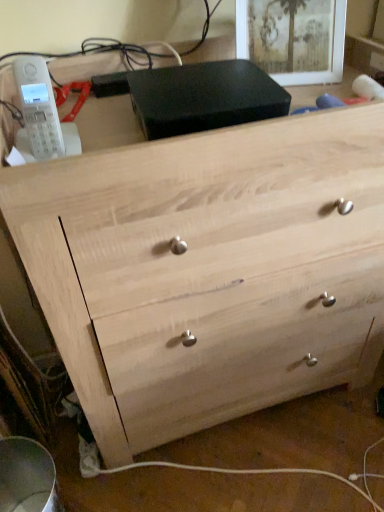
Question: Can you confirm if matte black picture frame at upper center is wider than natural wood chest of drawers at center?

Choices:
 (A) yes
 (B) no

Answer: (B)

Question: Does matte black picture frame at upper center appear on the left side of natural wood chest of drawers at center?

Choices:
 (A) yes
 (B) no

Answer: (B)

Question: From a real-world perspective, is matte black picture frame at upper center positioned over natural wood chest of drawers at center based on gravity?

Choices:
 (A) yes
 (B) no

Answer: (A)

Question: Can you see matte black picture frame at upper center touching natural wood chest of drawers at center?

Choices:
 (A) no
 (B) yes

Answer: (A)

Question: Can you confirm if matte black picture frame at upper center is positioned to the right of natural wood chest of drawers at center?

Choices:
 (A) no
 (B) yes

Answer: (B)

Question: Does matte black picture frame at upper center turn towards natural wood chest of drawers at center?

Choices:
 (A) no
 (B) yes

Answer: (B)

Question: Considering the relative positions of natural wood chest of drawers at center and matte black picture frame at upper center in the image provided, is natural wood chest of drawers at center behind matte black picture frame at upper center?

Choices:
 (A) no
 (B) yes

Answer: (A)

Question: Considering the relative sizes of natural wood chest of drawers at center and matte black picture frame at upper center in the image provided, is natural wood chest of drawers at center wider than matte black picture frame at upper center?

Choices:
 (A) no
 (B) yes

Answer: (B)

Question: From a real-world perspective, is natural wood chest of drawers at center physically below matte black picture frame at upper center?

Choices:
 (A) no
 (B) yes

Answer: (B)

Question: Can you confirm if natural wood chest of drawers at center is positioned to the right of matte black picture frame at upper center?

Choices:
 (A) no
 (B) yes

Answer: (A)

Question: From the image's perspective, is natural wood chest of drawers at center located beneath matte black picture frame at upper center?

Choices:
 (A) no
 (B) yes

Answer: (B)

Question: Is natural wood chest of drawers at center aimed at matte black picture frame at upper center?

Choices:
 (A) no
 (B) yes

Answer: (A)

Question: Does point (284, 77) appear closer or farther from the camera than point (57, 238)?

Choices:
 (A) closer
 (B) farther

Answer: (B)